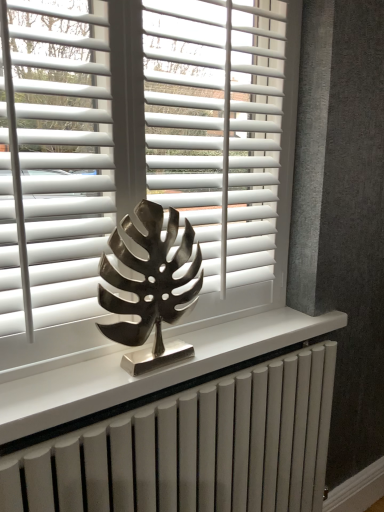
Question: Can you confirm if white matte blinds at center, which ranks as the 1th blind in right-to-left order, is shorter than metallic leaf sculpture at center?

Choices:
 (A) yes
 (B) no

Answer: (B)

Question: From a real-world perspective, is white matte blinds at center, which is the 2th blind in left-to-right order, positioned under metallic leaf sculpture at center based on gravity?

Choices:
 (A) yes
 (B) no

Answer: (B)

Question: Is white matte blinds at center, which ranks as the 1th blind in right-to-left order, oriented away from metallic leaf sculpture at center?

Choices:
 (A) yes
 (B) no

Answer: (B)

Question: From a real-world perspective, is white matte blinds at center, which is the 2th blind in left-to-right order, positioned over metallic leaf sculpture at center based on gravity?

Choices:
 (A) yes
 (B) no

Answer: (A)

Question: Does white matte blinds at center, which is the 2th blind in left-to-right order, appear on the right side of metallic leaf sculpture at center?

Choices:
 (A) yes
 (B) no

Answer: (A)

Question: Is point (119, 501) positioned closer to the camera than point (82, 229)?

Choices:
 (A) closer
 (B) farther

Answer: (A)

Question: In terms of height, does white metallic radiator at center look taller or shorter compared to white matte blinds at center, placed as the first blind when sorted from left to right?

Choices:
 (A) tall
 (B) short

Answer: (B)

Question: Looking at their shapes, would you say white metallic radiator at center is wider or thinner than white matte blinds at center, which is the 2th blind in right-to-left order?

Choices:
 (A) thin
 (B) wide

Answer: (B)

Question: From the image's perspective, is white metallic radiator at center positioned above or below white matte blinds at center, placed as the first blind when sorted from left to right?

Choices:
 (A) below
 (B) above

Answer: (A)

Question: From the image's perspective, is white matte blinds at center above or below white metallic radiator at center?

Choices:
 (A) below
 (B) above

Answer: (B)

Question: In terms of width, does white matte blinds at center look wider or thinner when compared to white metallic radiator at center?

Choices:
 (A) thin
 (B) wide

Answer: (A)

Question: Relative to white metallic radiator at center, is white matte blinds at center in front or behind?

Choices:
 (A) front
 (B) behind

Answer: (A)

Question: From their relative heights in the image, would you say white matte blinds at center is taller or shorter than white metallic radiator at center?

Choices:
 (A) short
 (B) tall

Answer: (B)

Question: From their relative heights in the image, would you say white metallic radiator at center is taller or shorter than metallic leaf sculpture at center?

Choices:
 (A) tall
 (B) short

Answer: (A)

Question: Based on their positions, is white metallic radiator at center located to the left or right of metallic leaf sculpture at center?

Choices:
 (A) left
 (B) right

Answer: (B)